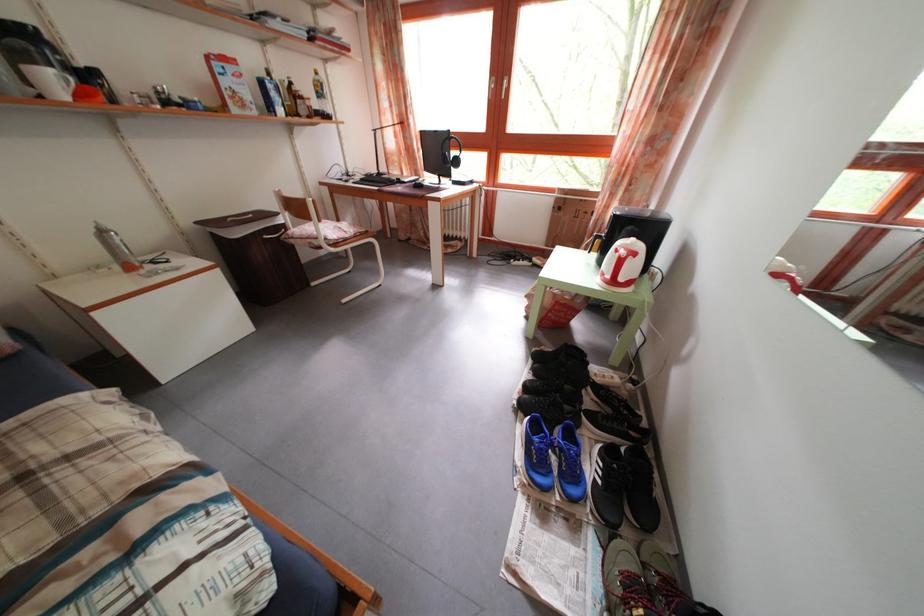
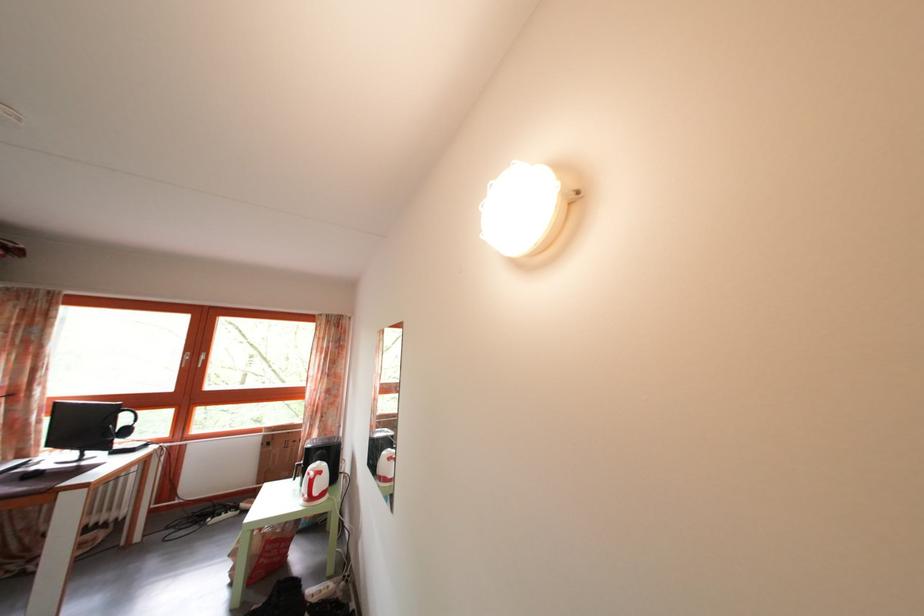
In the second image, find the point that corresponds to point (641, 262) in the first image.

(327, 480)